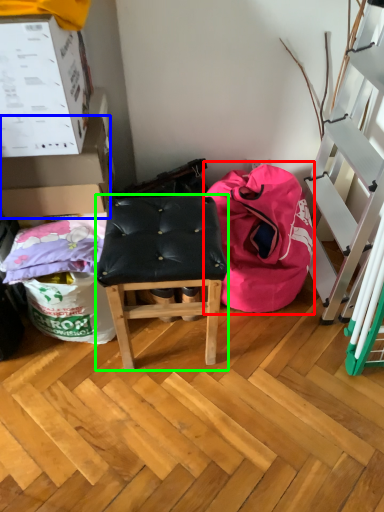
Question: Which object is positioned farthest from bean bag chair (highlighted by a red box)? Select from box (highlighted by a blue box) and stool (highlighted by a green box).

Choices:
 (A) box
 (B) stool

Answer: (A)